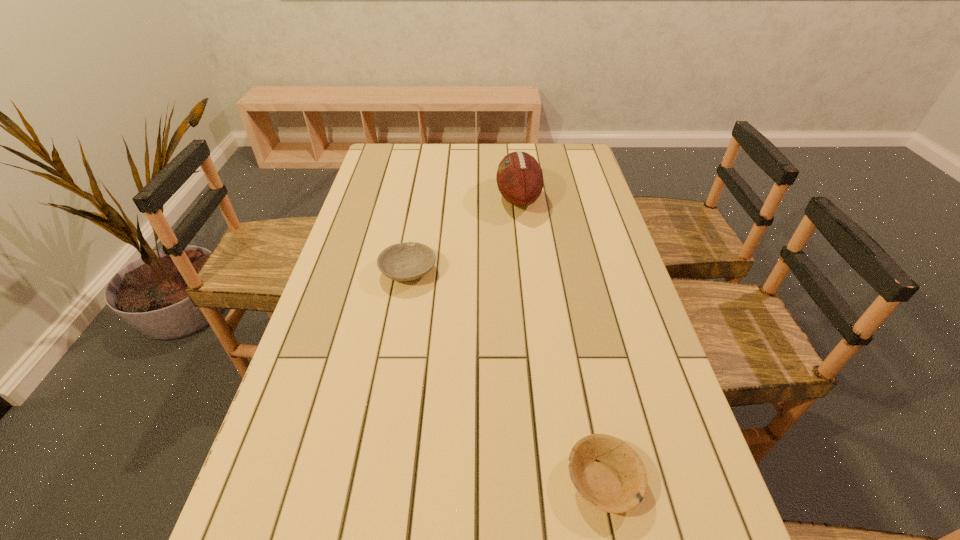
Image resolution: width=960 pixels, height=540 pixels. I want to click on vacant area between the second nearest object and the farthest object, so click(x=464, y=235).

This screenshot has width=960, height=540. I want to click on blank region between the football (American) and the right bowl, so click(x=561, y=339).

Image resolution: width=960 pixels, height=540 pixels. Identify the location of object that is the second closest to the farthest object. pos(608,474).

You are a GUI agent. You are given a task and a screenshot of the screen. Output one action in this format:
    pyautogui.click(x=<x>, y=<y>)
    Task: Click on the object identified as the closest to the nearest object
    The image size is (960, 540).
    Given the screenshot: What is the action you would take?
    pyautogui.click(x=407, y=261)

Locate an element on the screen. The height and width of the screenshot is (540, 960). vacant space that satisfies the following two spatial constraints: 1. on the front side of the farthest object; 2. on the left side of the right bowl is located at coordinates (551, 480).